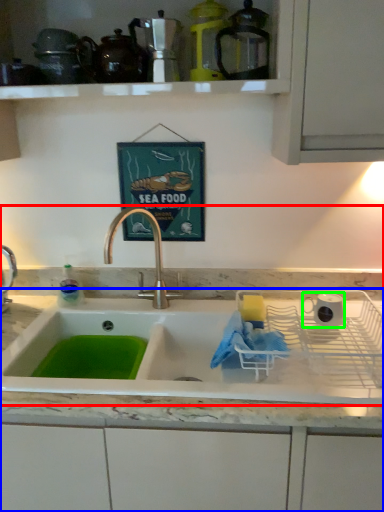
Question: Based on their relative distances, which object is nearer to sink (highlighted by a red box)? Choose from countertop (highlighted by a blue box) and appliance (highlighted by a green box).

Choices:
 (A) countertop
 (B) appliance

Answer: (A)